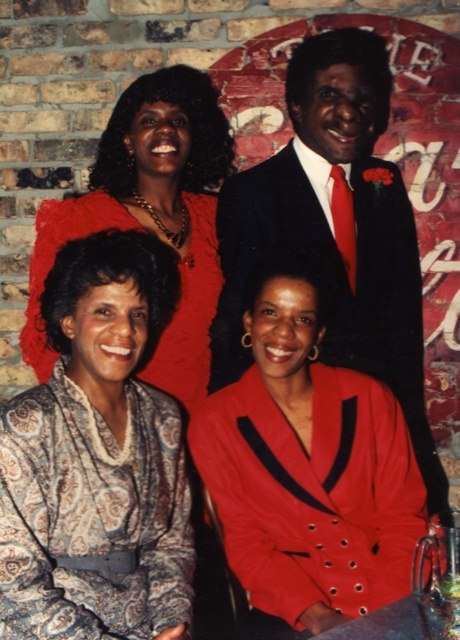
Can you confirm if shiny black suit at upper center is wider than paisley fabric dress at lower left?

Yes.

Can you confirm if shiny black suit at upper center is taller than paisley fabric dress at lower left?

Correct, shiny black suit at upper center is much taller as paisley fabric dress at lower left.

Find the location of a particular element. shiny black suit at upper center is located at coordinates (335, 228).

Who is positioned more to the right, paisley-patterned dress at lower left or shiny black suit at upper center?

shiny black suit at upper center

Is paisley-patterned dress at lower left below shiny black suit at upper center?

Indeed, paisley-patterned dress at lower left is positioned under shiny black suit at upper center.

Where is `paisley-patterned dress at lower left`? The width and height of the screenshot is (460, 640). paisley-patterned dress at lower left is located at coordinates (97, 460).

What are the coordinates of `paisley-patterned dress at lower left` in the screenshot? It's located at point(97,460).

Who is positioned more to the left, paisley-patterned dress at lower left or shiny red blazer at center?

paisley-patterned dress at lower left

The height and width of the screenshot is (640, 460). Describe the element at coordinates (97, 460) in the screenshot. I see `paisley-patterned dress at lower left` at that location.

What are the coordinates of `paisley-patterned dress at lower left` in the screenshot? It's located at 97,460.